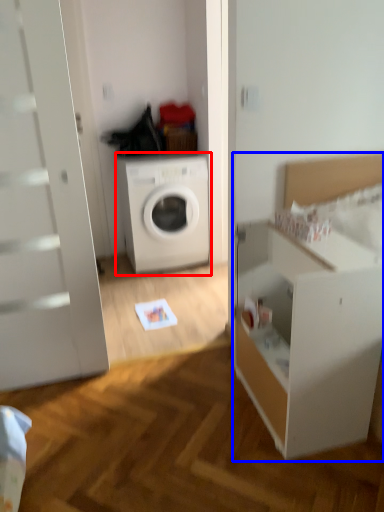
Question: Which object appears farthest to the camera in this image, washing machine (highlighted by a red box) or dresser (highlighted by a blue box)?

Choices:
 (A) washing machine
 (B) dresser

Answer: (A)